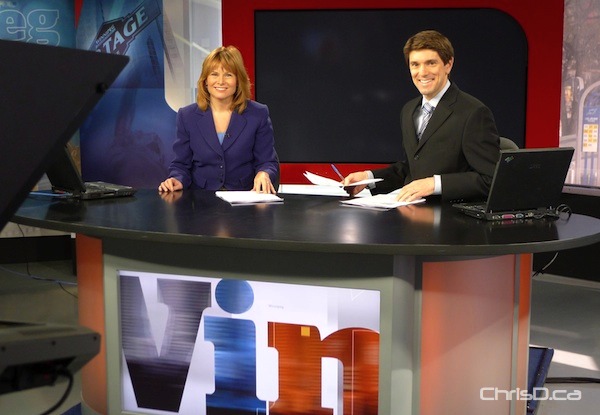
At what (x,y) coordinates should I click in order to perform the action: click on table. Please return your answer as a coordinate pair (x, y). The height and width of the screenshot is (415, 600). Looking at the image, I should click on (337, 222).